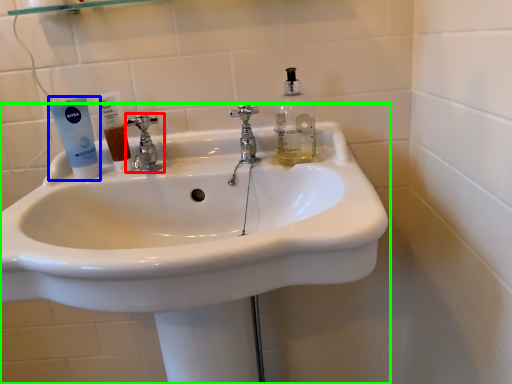
Question: Which object is the farthest from tap (highlighted by a red box)? Choose among these: toothpaste (highlighted by a blue box) or sink (highlighted by a green box).

Choices:
 (A) toothpaste
 (B) sink

Answer: (B)